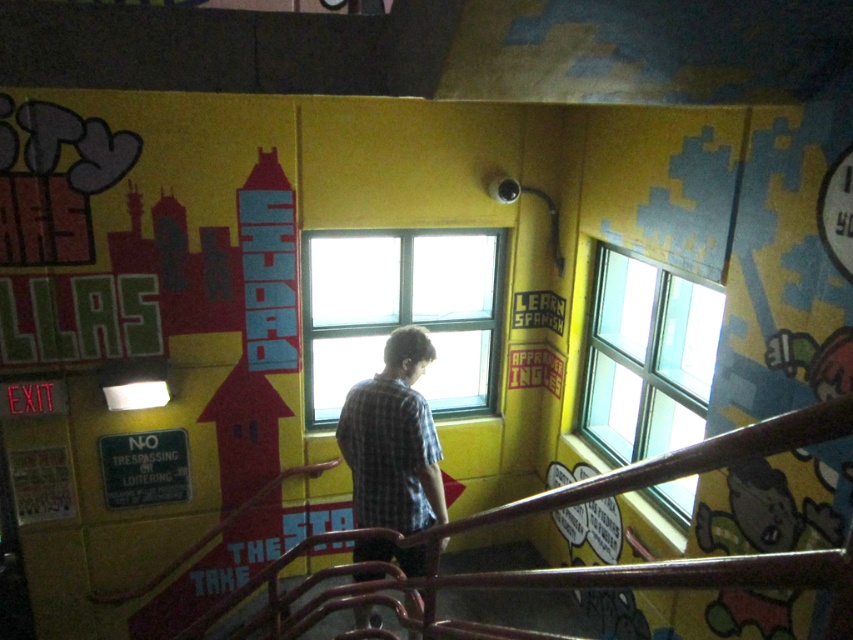
Question: Which point is closer to the camera taking this photo?

Choices:
 (A) (474, 260)
 (B) (665, 436)

Answer: (B)

Question: Is rusty metal railing at center above clear glass window at upper center?

Choices:
 (A) yes
 (B) no

Answer: (B)

Question: From the image, what is the correct spatial relationship of rusty metal railing at center in relation to clear glass window at upper center?

Choices:
 (A) below
 (B) above

Answer: (A)

Question: Which of the following is the farthest from the observer?

Choices:
 (A) clear glass window at upper center
 (B) rusty metal railing at center
 (C) clear glass window at center
 (D) checkered fabric shirt at center

Answer: (C)

Question: Is rusty metal railing at center positioned before checkered fabric shirt at center?

Choices:
 (A) yes
 (B) no

Answer: (A)

Question: Which of the following is the farthest from the observer?

Choices:
 (A) (480, 381)
 (B) (761, 573)
 (C) (717, 316)
 (D) (409, 336)

Answer: (A)